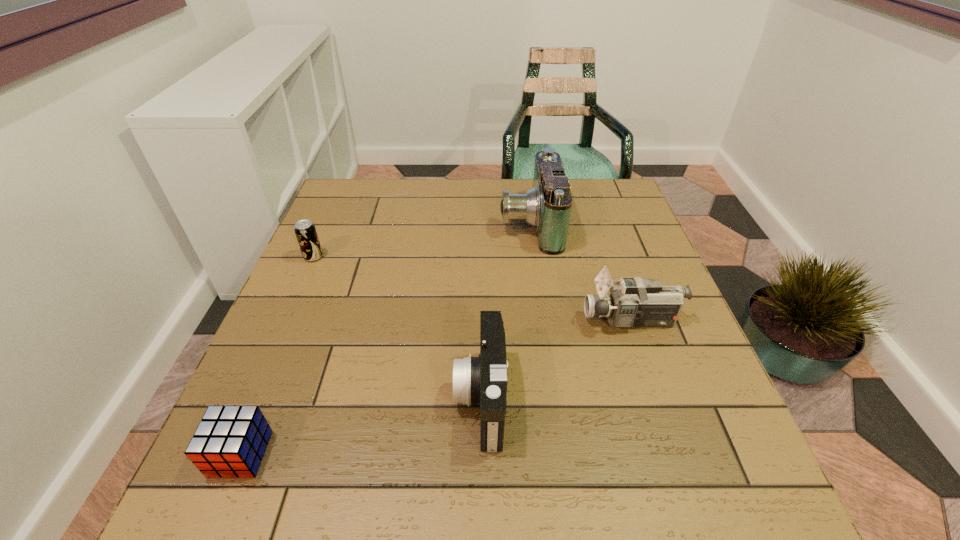
Where is `vacant space at the far right corner of the desktop`? Image resolution: width=960 pixels, height=540 pixels. vacant space at the far right corner of the desktop is located at coordinates (632, 212).

In the image, there is a desktop. Where is `vacant space at the near right corner`? vacant space at the near right corner is located at coordinates (725, 476).

Locate an element on the screen. vacant area between the cube and the leftmost camcorder is located at coordinates (361, 426).

This screenshot has height=540, width=960. I want to click on vacant space that's between the third object from right to left and the soda can, so click(397, 327).

Locate an element on the screen. empty location between the third farthest object and the shortest object is located at coordinates (436, 387).

What are the coordinates of `vacant region between the nearest camcorder and the farthest camcorder` in the screenshot? It's located at coord(505,310).

This screenshot has width=960, height=540. I want to click on vacant region between the soda can and the tallest camcorder, so click(x=421, y=240).

Image resolution: width=960 pixels, height=540 pixels. I want to click on unoccupied position between the second shortest object and the nearest camcorder, so click(x=397, y=327).

This screenshot has width=960, height=540. I want to click on free space between the second camcorder from left to right and the fourth tallest object, so click(421, 240).

This screenshot has width=960, height=540. Identify the location of vacant space in between the nearest camcorder and the shortest object. (361, 426).